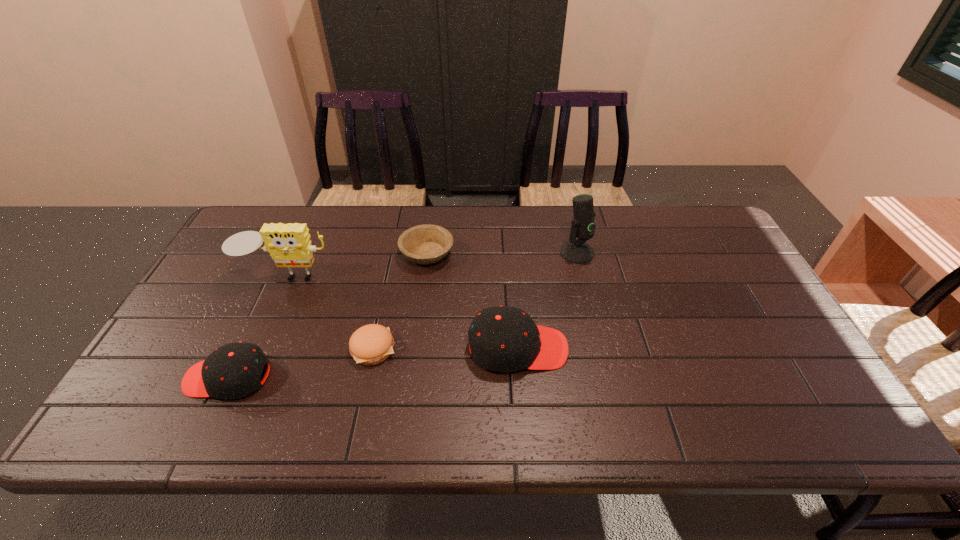
I want to click on vacant space positioned on the left of the microphone, so click(480, 253).

You are a GUI agent. You are given a task and a screenshot of the screen. Output one action in this format:
    pyautogui.click(x=<x>, y=<y>)
    Task: Click on the blank area located 0.190m on the front-facing side of the sponge
    
    Given the screenshot: What is the action you would take?
    pyautogui.click(x=257, y=342)

Where is `vacant space located on the back of the bowl`? vacant space located on the back of the bowl is located at coordinates (431, 224).

Where is `vacant space located on the back of the patty`? The height and width of the screenshot is (540, 960). vacant space located on the back of the patty is located at coordinates (395, 251).

Where is `microphone present at the far edge`? The image size is (960, 540). microphone present at the far edge is located at coordinates (575, 251).

In order to click on bowl that is at the far edge in this screenshot , I will do `click(424, 244)`.

Where is `patty that is at the near edge`? Image resolution: width=960 pixels, height=540 pixels. patty that is at the near edge is located at coordinates (371, 344).

At what (x,y) coordinates should I click in order to perform the action: click on cap that is positioned at the left edge. Please return your answer as a coordinate pair (x, y). Looking at the image, I should click on (232, 371).

Image resolution: width=960 pixels, height=540 pixels. I want to click on sponge at the left edge, so click(289, 245).

This screenshot has height=540, width=960. What are the coordinates of `object situated at the near left corner` in the screenshot? It's located at (232, 371).